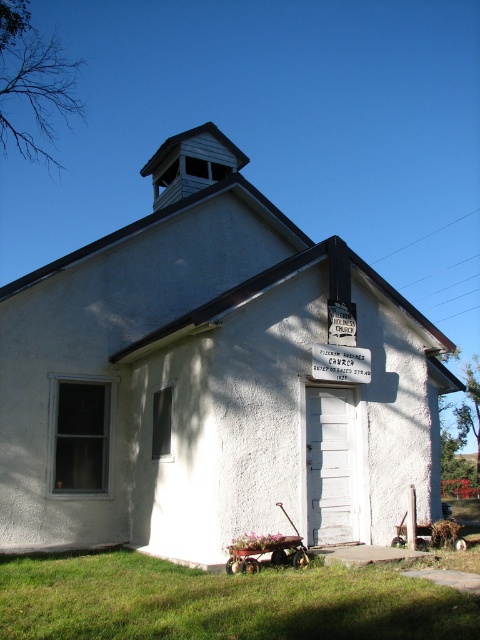
Question: Which point is farther to the camera?

Choices:
 (A) white plastic sign at center
 (B) white stucco church at center

Answer: (A)

Question: Is white stucco church at center to the left of white plastic sign at center from the viewer's perspective?

Choices:
 (A) yes
 (B) no

Answer: (A)

Question: Is white stucco church at center smaller than white plastic sign at center?

Choices:
 (A) no
 (B) yes

Answer: (A)

Question: Does white stucco church at center come in front of white plastic sign at center?

Choices:
 (A) yes
 (B) no

Answer: (A)